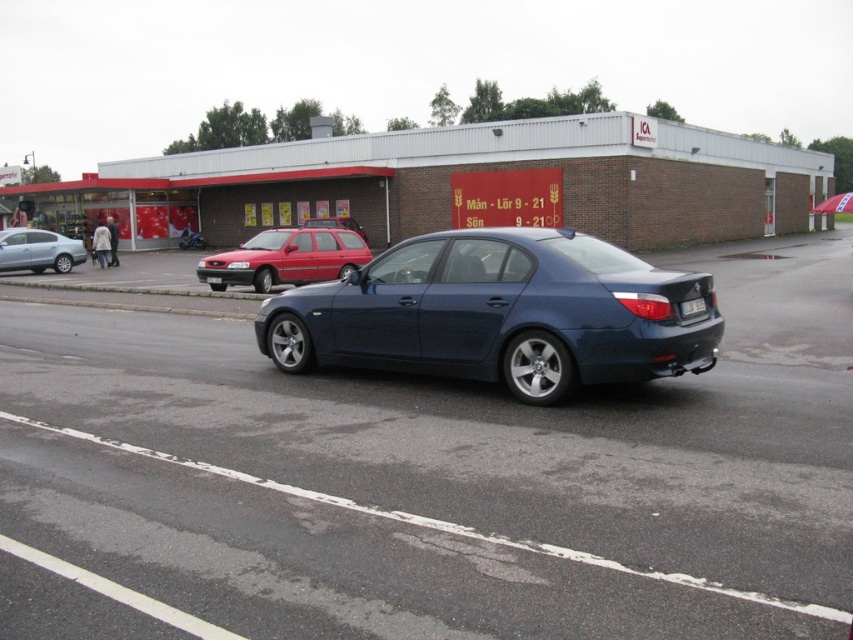
You are standing in front of the ICA Supermarket building. Where is the white plastic license plate at rear located in terms of its 2D coordinates?

The white plastic license plate at rear is located at the 2D coordinates of point (692, 307).

Based on the photo, you are a delivery person who needs to park your vehicle in a spot that can accommodate your large truck. You see the satin blue sedan at center and the white plastic license plate at center in the parking lot. Which vehicle can you safely park next to without blocking the license plate?

The satin blue sedan at center is bigger than the white plastic license plate at center, so you can safely park next to the white plastic license plate at center without blocking it.

You are a delivery person who needs to park your vehicle between two cars in the parking lot. The metallic blue car at center and the matte red station wagon at center are already parked. Which car is shorter and would allow you to park closer to the entrance?

The metallic blue car at center is shorter than the matte red station wagon at center, so you can park closer to the entrance near the metallic blue car at center.